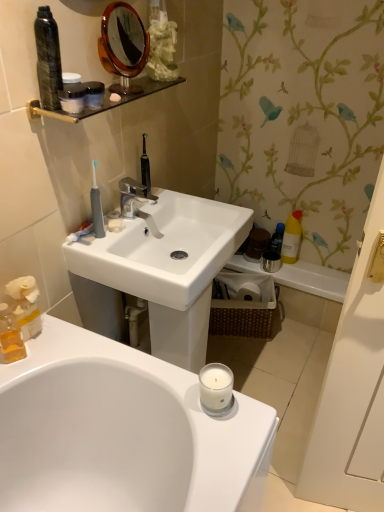
The height and width of the screenshot is (512, 384). I want to click on metallic silver bath at lower right, so coord(300,277).

Measure the distance between point (294, 236) and camera.

They are 2.14 meters apart.

How much space does yellow matte bottle at right, which is the second mouthwash from back to front, occupy horizontally?

yellow matte bottle at right, which is the second mouthwash from back to front, is 8.30 centimeters in width.

The width and height of the screenshot is (384, 512). Identify the location of matte black container at upper left, marked as the 3th mouthwash in a front-to-back arrangement. (72, 94).

Measure the distance between white matte soap at center and camera.

white matte soap at center and camera are 1.32 meters apart from each other.

Identify the location of metallic silver bath at lower right. (300, 277).

Is translucent yellow liquid at lower left, arranged as the fifth mouthwash when viewed from the top, far away from orange wooden mirror at upper center?

No, translucent yellow liquid at lower left, arranged as the fifth mouthwash when viewed from the top, is not far away from orange wooden mirror at upper center.

Which object is thinner, translucent yellow liquid at lower left, the first mouthwash from the front, or orange wooden mirror at upper center?

translucent yellow liquid at lower left, the first mouthwash from the front, is thinner.

Based on the photo, which of these two, translucent yellow liquid at lower left, the first mouthwash from the front, or orange wooden mirror at upper center, stands shorter?

Standing shorter between the two is translucent yellow liquid at lower left, the first mouthwash from the front.

Is translucent yellow liquid at lower left, the fifth mouthwash from the right, positioned beyond the bounds of orange wooden mirror at upper center?

Yes.

Is black glass shelf at upper center outside of orange wooden mirror at upper center?

black glass shelf at upper center lies outside orange wooden mirror at upper center's area.

How different are the orientations of black glass shelf at upper center and orange wooden mirror at upper center in degrees?

12.4 degrees.

Based on the photo, from the image's perspective, between black glass shelf at upper center and orange wooden mirror at upper center, who is located below?

black glass shelf at upper center.

Is black glass shelf at upper center not close to orange wooden mirror at upper center?

That's not correct — black glass shelf at upper center is a little close to orange wooden mirror at upper center.

From a real-world perspective, which is physically above, gray rubber toothbrush at upper left or satin black container at upper left, the second mouthwash when ordered from front to back?

satin black container at upper left, the second mouthwash when ordered from front to back.

Which object is positioned more to the left, gray rubber toothbrush at upper left or satin black container at upper left, acting as the fourth mouthwash starting from the bottom?

Positioned to the left is gray rubber toothbrush at upper left.

Which of these two, gray rubber toothbrush at upper left or satin black container at upper left, the second mouthwash when ordered from front to back, is smaller?

satin black container at upper left, the second mouthwash when ordered from front to back.

From the image's perspective, is black glass shelf at upper center over blue plastic bottle at right, which is counted as the 4th mouthwash, starting from the top?

Yes.

Does black glass shelf at upper center come in front of blue plastic bottle at right, placed as the first mouthwash when sorted from back to front?

Yes, black glass shelf at upper center is closer to the camera.

Does point (180, 76) come in front of point (277, 251)?

Yes, it is.

Based on their positions, is black glass shelf at upper center located to the left or right of blue plastic bottle at right, the second mouthwash positioned from the bottom?

black glass shelf at upper center is positioned on blue plastic bottle at right, the second mouthwash positioned from the bottom,'s left side.

Which point is more forward, (86, 82) or (70, 103)?

The point (70, 103) is closer.

From the image's perspective, is satin black container at upper left, acting as the fourth mouthwash starting from the bottom, located beneath matte black container at upper left, marked as the 3th mouthwash in a front-to-back arrangement?

Indeed, from the image's perspective, satin black container at upper left, acting as the fourth mouthwash starting from the bottom, is shown beneath matte black container at upper left, marked as the 3th mouthwash in a front-to-back arrangement.

Does satin black container at upper left, which is the third mouthwash in left-to-right order, have a greater height compared to matte black container at upper left, marked as the 3th mouthwash in a front-to-back arrangement?

No.

Considering the relative positions of orange wooden mirror at upper center and gray rubber toothbrush at upper left in the image provided, is orange wooden mirror at upper center to the left of gray rubber toothbrush at upper left from the viewer's perspective?

Incorrect, orange wooden mirror at upper center is not on the left side of gray rubber toothbrush at upper left.

Is orange wooden mirror at upper center wider than gray rubber toothbrush at upper left?

Yes.

Is orange wooden mirror at upper center next to gray rubber toothbrush at upper left and touching it?

No.

Is orange wooden mirror at upper center bigger or smaller than gray rubber toothbrush at upper left?

Clearly, orange wooden mirror at upper center is larger in size than gray rubber toothbrush at upper left.

Does point (297, 234) come behind point (102, 56)?

Yes, it is behind point (102, 56).

Is yellow matte bottle at right, the fourth mouthwash from the front, wider than orange wooden mirror at upper center?

Correct, the width of yellow matte bottle at right, the fourth mouthwash from the front, exceeds that of orange wooden mirror at upper center.

Are yellow matte bottle at right, placed as the first mouthwash when sorted from right to left, and orange wooden mirror at upper center beside each other?

There is a gap between yellow matte bottle at right, placed as the first mouthwash when sorted from right to left, and orange wooden mirror at upper center.

Locate an element on the screen. The width and height of the screenshot is (384, 512). the 3rd mouthwash counting from the left side of the orange wooden mirror at upper center is located at coordinates (10, 336).

Locate an element on the screen. This screenshot has width=384, height=512. mirror on the right side of black glass shelf at upper center is located at coordinates (123, 46).

From the image, which object appears to be farther from satin black container at upper left, which appears as the 2th mouthwash when viewed from the top, metallic silver bath at lower right or white ceramic faucet at center?

The object further to satin black container at upper left, which appears as the 2th mouthwash when viewed from the top, is metallic silver bath at lower right.

Considering their positions, is yellow matte bottle at right, which is the second mouthwash from back to front, positioned further to black glass shelf at upper center than satin black container at upper left, the second mouthwash when ordered from front to back?

yellow matte bottle at right, which is the second mouthwash from back to front, is further to black glass shelf at upper center.

Looking at the image, which one is located closer to translucent yellow liquid at lower left, marked as the first mouthwash in a bottom-to-top arrangement, black glass shelf at upper center or yellow matte bottle at right, which is the third mouthwash from bottom to top?

black glass shelf at upper center.

Looking at the image, which one is located further to white matte soap at center, satin black container at upper left, acting as the fourth mouthwash starting from the bottom, or orange wooden mirror at upper center?

Based on the image, orange wooden mirror at upper center appears to be further to white matte soap at center.

Looking at this image, looking at the image, which one is located closer to matte black container at upper left, arranged as the 4th mouthwash when viewed from the right, white matte soap at center or yellow matte bottle at right, which is the third mouthwash from bottom to top?

The object closer to matte black container at upper left, arranged as the 4th mouthwash when viewed from the right, is white matte soap at center.

Which object lies further to the anchor point black glass shelf at upper center, matte black container at upper left, marked as the 3th mouthwash in a front-to-back arrangement, or white ceramic faucet at center?

Based on the image, white ceramic faucet at center appears to be further to black glass shelf at upper center.

When comparing their distances from black glass shelf at upper center, does blue plastic bottle at right, which is counted as the 4th mouthwash, starting from the top, or white matte soap at center seem further?

blue plastic bottle at right, which is counted as the 4th mouthwash, starting from the top, lies further to black glass shelf at upper center than the other object.

Based on their spatial positions, is blue plastic bottle at right, which is counted as the 4th mouthwash, starting from the top, or metallic silver bath at lower right closer to satin black container at upper left, the third mouthwash from the right?

Based on the image, blue plastic bottle at right, which is counted as the 4th mouthwash, starting from the top, appears to be nearer to satin black container at upper left, the third mouthwash from the right.

Identify the location of mouthwash between matte black container at upper left, which appears as the fifth mouthwash when ordered from the bottom, and black glass shelf at upper center, in the horizontal direction. This screenshot has height=512, width=384. (94, 94).

At what (x,y) coordinates should I click in order to perform the action: click on mouthwash that lies between yellow matte bottle at right, which is the second mouthwash from back to front, and metallic silver bath at lower right from top to bottom. Please return your answer as a coordinate pair (x, y). Image resolution: width=384 pixels, height=512 pixels. Looking at the image, I should click on (277, 238).

Locate an element on the screen. The width and height of the screenshot is (384, 512). tap between black glass shelf at upper center and gray rubber toothbrush at upper left vertically is located at coordinates (135, 202).

The image size is (384, 512). I want to click on toothbrush located between orange wooden mirror at upper center and metallic silver bath at lower right in the depth direction, so [x=96, y=206].